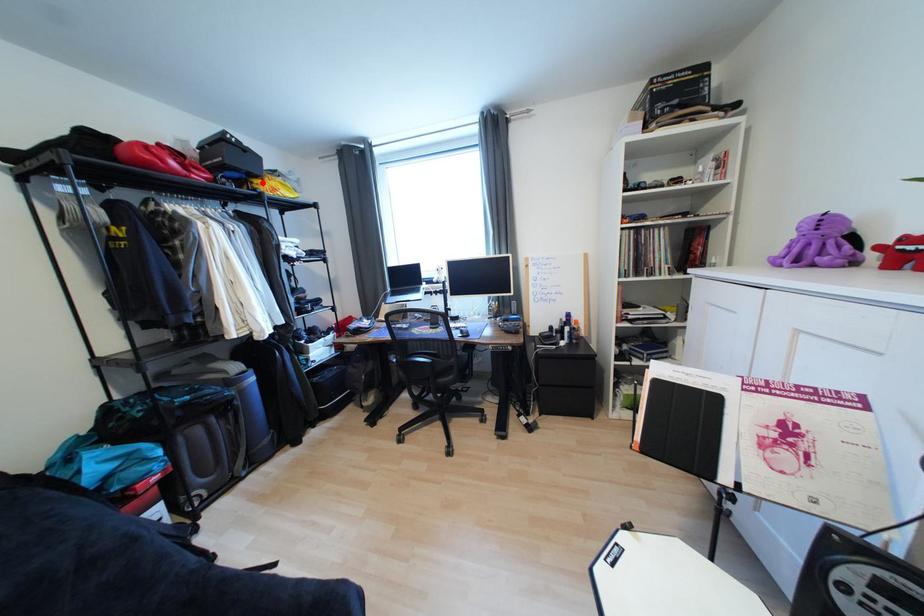
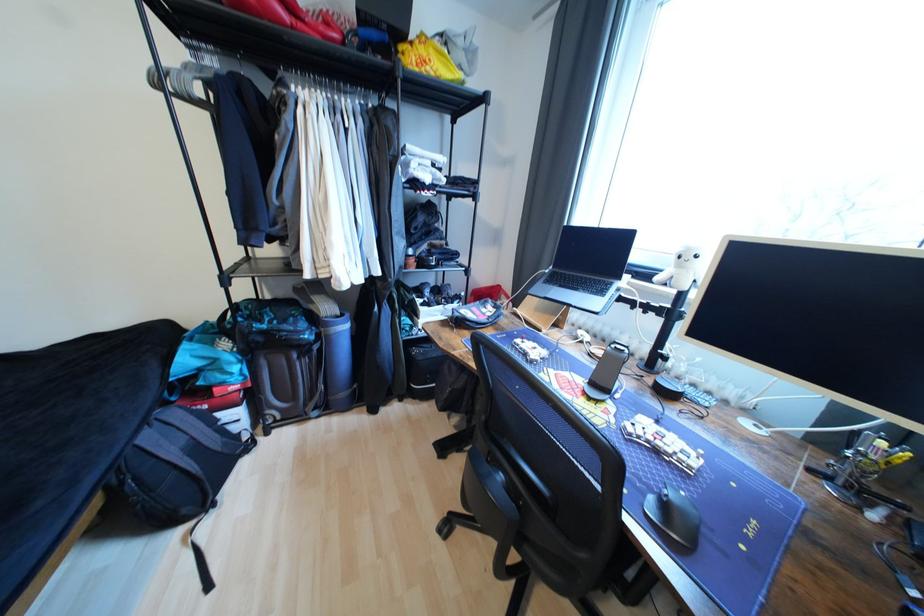
Locate, in the second image, the point that corresponds to the highlighted location in the first image.

(407, 49)